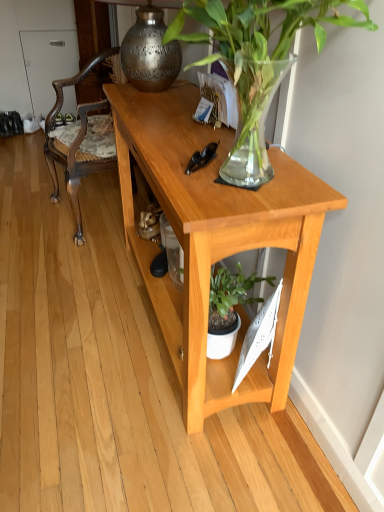
Locate an element on the screen. The image size is (384, 512). vacant space in front of polished brass lamp at upper center is located at coordinates (161, 116).